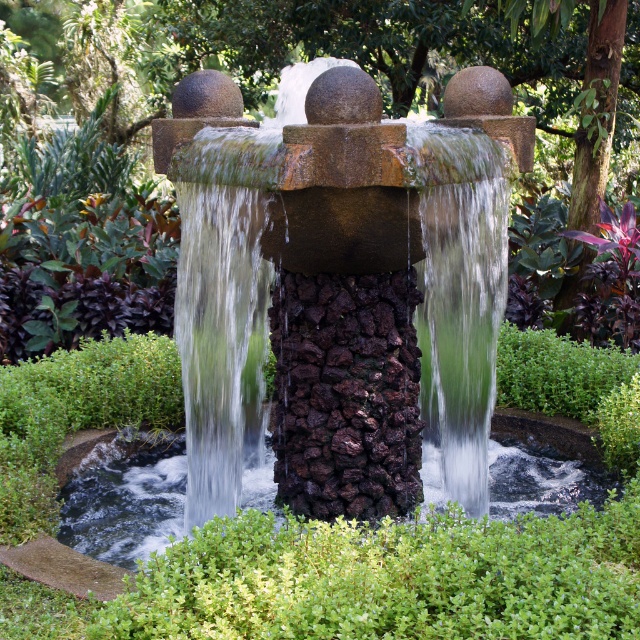
Question: Which point is farther to the camera?

Choices:
 (A) (112, 481)
 (B) (432, 272)

Answer: (A)

Question: Can you confirm if green mossy rock at center is positioned above clear water at center?

Choices:
 (A) no
 (B) yes

Answer: (B)

Question: Is smooth stone fountain at center closer to the viewer compared to green mossy rock at center?

Choices:
 (A) yes
 (B) no

Answer: (A)

Question: Which of these objects is positioned farthest from the clear water at center?

Choices:
 (A) smooth stone fountain at center
 (B) green mossy rock at center

Answer: (B)

Question: Which of these objects is positioned farthest from the smooth stone fountain at center?

Choices:
 (A) clear water at center
 (B) green mossy rock at center

Answer: (A)

Question: Is green mossy rock at center thinner than clear water at center?

Choices:
 (A) yes
 (B) no

Answer: (A)